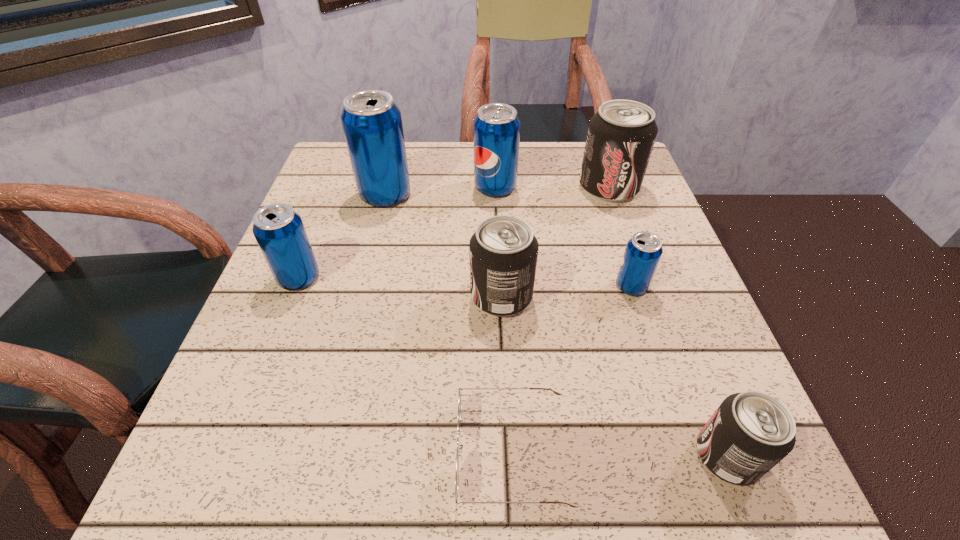
Find the location of a particular element. vacant area situated on the front-facing side of the sunglasses is located at coordinates (311, 451).

Identify the location of free spot located on the front-facing side of the sunglasses. Image resolution: width=960 pixels, height=540 pixels. (388, 451).

The width and height of the screenshot is (960, 540). I want to click on vacant region located 0.210m on the front-facing side of the sunglasses, so click(x=311, y=451).

This screenshot has width=960, height=540. Find the location of `soda can at the near edge`. soda can at the near edge is located at coordinates (750, 432).

The image size is (960, 540). Identify the location of sunglasses located at the near edge. (459, 393).

Locate an element on the screen. object that is at the far left corner is located at coordinates (372, 123).

Find the location of `object located in the far right corner section of the desktop`. object located in the far right corner section of the desktop is located at coordinates (621, 135).

You are a GUI agent. You are given a task and a screenshot of the screen. Output one action in this format:
    pyautogui.click(x=<x>, y=<y>)
    Task: Click on the object that is at the near right corner
    The width and height of the screenshot is (960, 540).
    Given the screenshot: What is the action you would take?
    pyautogui.click(x=750, y=432)

Image resolution: width=960 pixels, height=540 pixels. Identify the location of free region at the far edge. (538, 154).

The image size is (960, 540). Find the location of `vacant space at the near edge of the desktop`. vacant space at the near edge of the desktop is located at coordinates (651, 468).